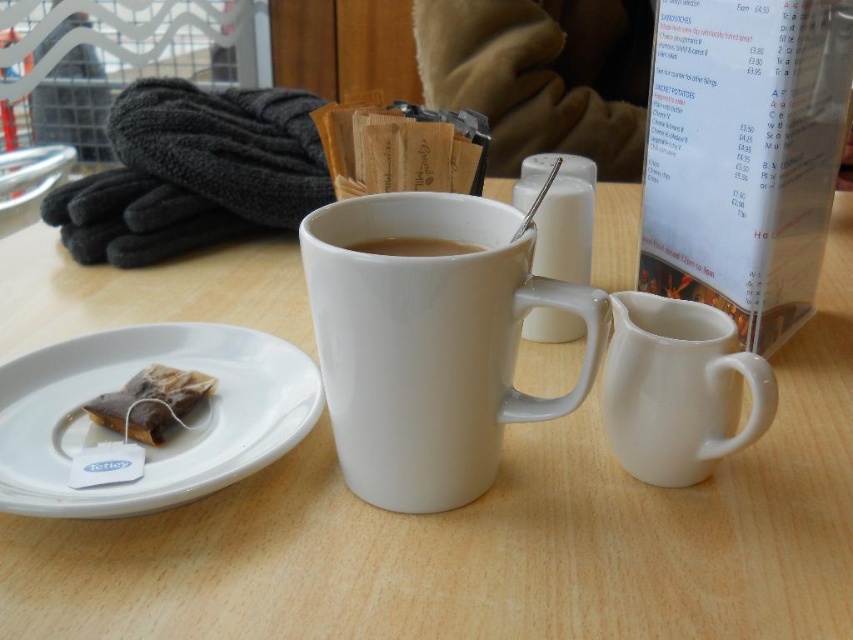
Consider the image. Can you confirm if white glossy mug at center is positioned to the left of brown paper tea bag at left?

No, white glossy mug at center is not to the left of brown paper tea bag at left.

The height and width of the screenshot is (640, 853). Identify the location of white glossy mug at center. (489, 538).

Who is more forward, (160, 504) or (732, 355)?

Point (160, 504) is more forward.

Is white ceramic saucer at lower left to the right of white glossy creamer at right from the viewer's perspective?

No, white ceramic saucer at lower left is not to the right of white glossy creamer at right.

Is point (146, 352) behind point (727, 435)?

That is True.

The image size is (853, 640). I want to click on white ceramic saucer at lower left, so click(x=173, y=429).

Image resolution: width=853 pixels, height=640 pixels. Describe the element at coordinates (489, 538) in the screenshot. I see `white glossy mug at center` at that location.

Does point (766, 600) come closer to viewer compared to point (430, 253)?

Yes, point (766, 600) is in front of point (430, 253).

Locate an element on the screen. The width and height of the screenshot is (853, 640). white glossy mug at center is located at coordinates (489, 538).